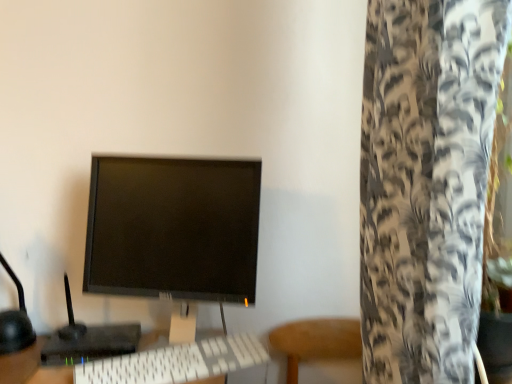
Question: From the image's perspective, is black matte monitor at center above or below black plastic monitor at center?

Choices:
 (A) above
 (B) below

Answer: (A)

Question: From a real-world perspective, is black matte monitor at center positioned above or below black plastic monitor at center?

Choices:
 (A) below
 (B) above

Answer: (B)

Question: Estimate the real-world distances between objects in this image. Which object is closer to the black plastic monitor at center?

Choices:
 (A) white textured curtain at right
 (B) black matte monitor at center
 (C) white plastic keyboard at center

Answer: (C)

Question: Estimate the real-world distances between objects in this image. Which object is closer to the black matte monitor at center?

Choices:
 (A) white textured curtain at right
 (B) black plastic monitor at center
 (C) white plastic keyboard at center

Answer: (C)